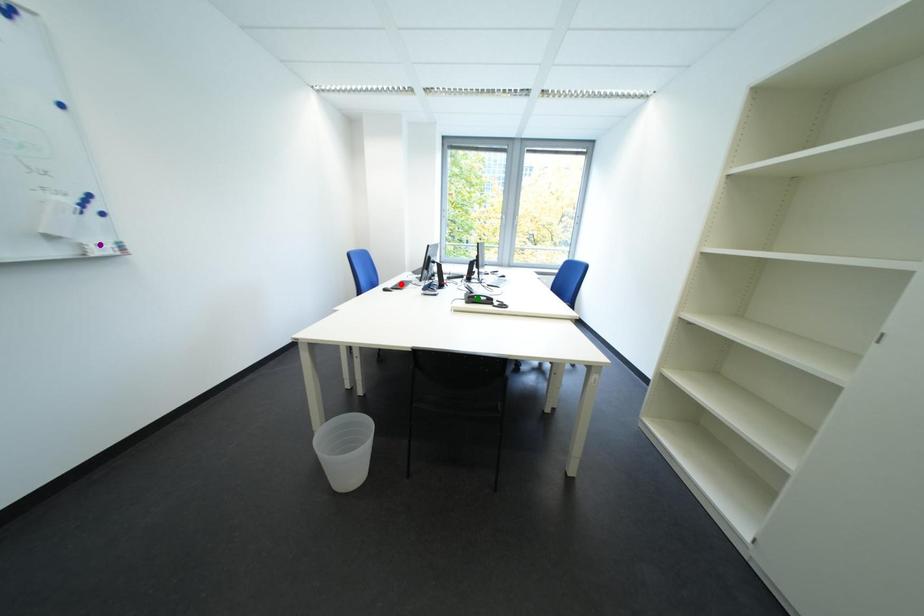
Order these from nearest to farthest:
red point, purple point, green point

red point → green point → purple point